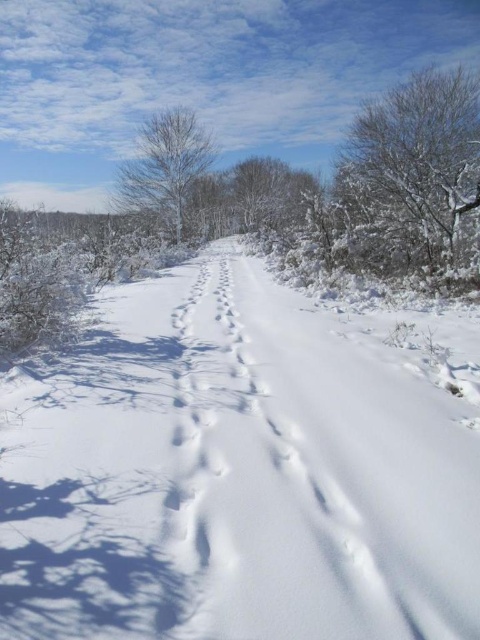
Who is positioned more to the right, snow-covered tree at upper right or bare snow-covered tree at center?

snow-covered tree at upper right

Is snow-covered tree at upper right further to the viewer compared to bare snow-covered tree at center?

No, snow-covered tree at upper right is in front of bare snow-covered tree at center.

Who is more forward, (355, 132) or (167, 144)?

Point (355, 132)

You are a GUI agent. You are given a task and a screenshot of the screen. Output one action in this format:
    pyautogui.click(x=<x>, y=<y>)
    Task: Click on the snow-covered tree at upper right
    
    Given the screenshot: What is the action you would take?
    pyautogui.click(x=415, y=180)